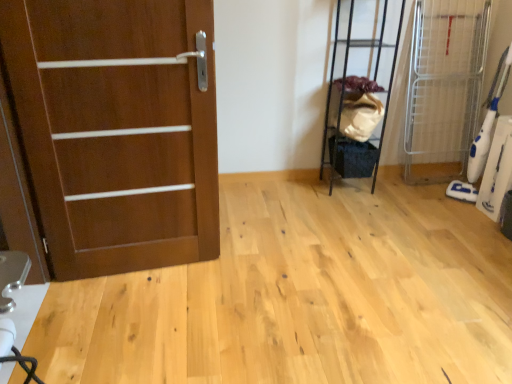
Locate an element on the screen. This screenshot has height=384, width=512. vacant space underneath matte wood door at left (from a real-world perspective) is located at coordinates (141, 272).